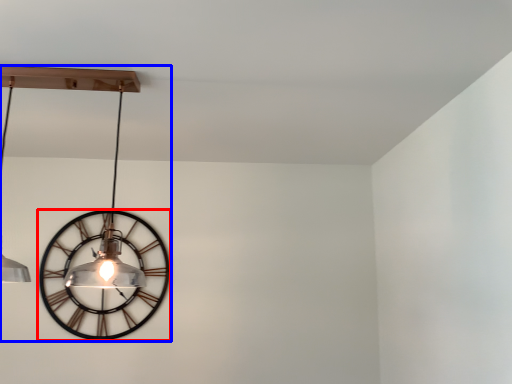
Question: Which object appears farthest to the camera in this image, wall clock (highlighted by a red box) or lamp (highlighted by a blue box)?

Choices:
 (A) wall clock
 (B) lamp

Answer: (A)